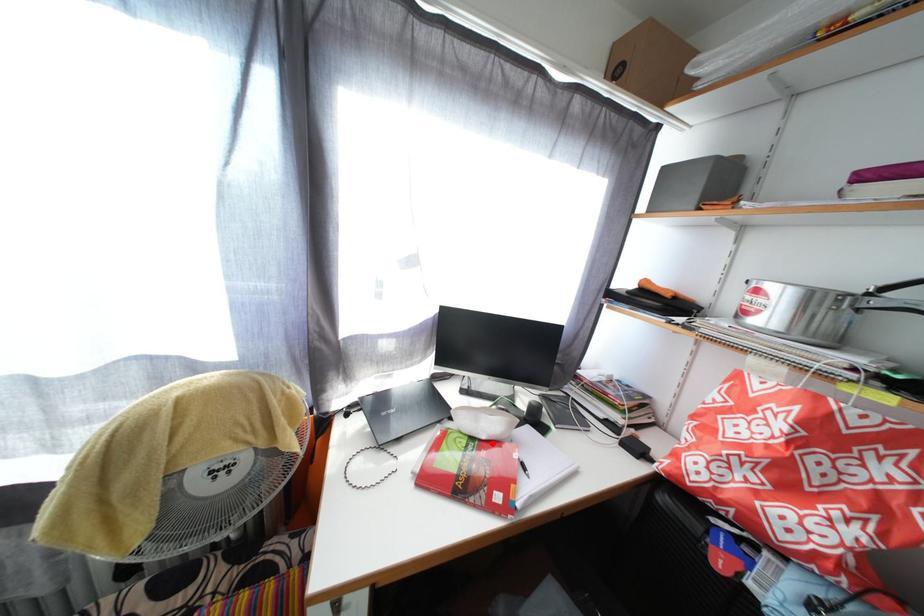
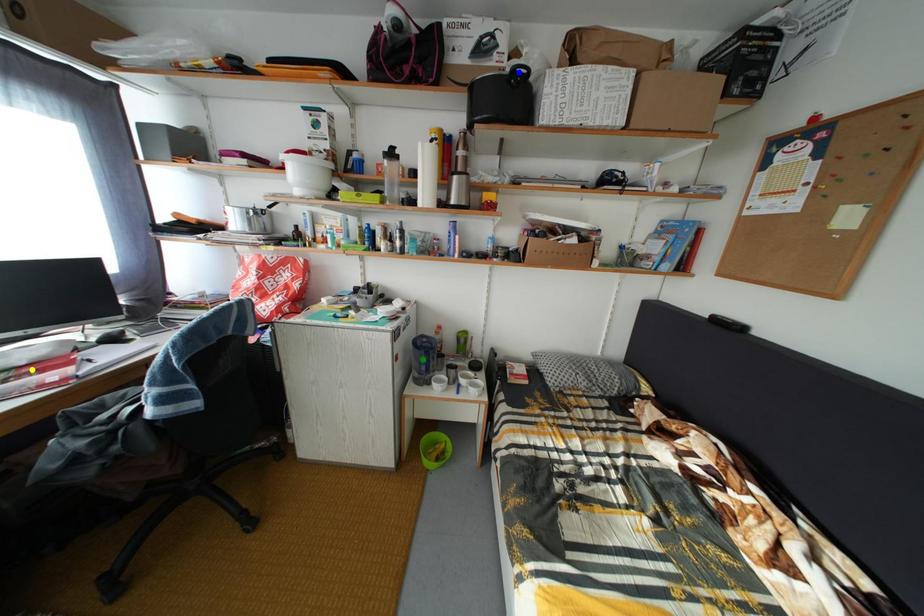
Question: I am providing you with two images of the same scene from different viewpoints. A red point is marked on the first image. You are given multiple points on the second image. Which mark in image 2 goes with the point in image 1?

Choices:
 (A) yellow point
 (B) green point
 (C) blue point

Answer: (A)